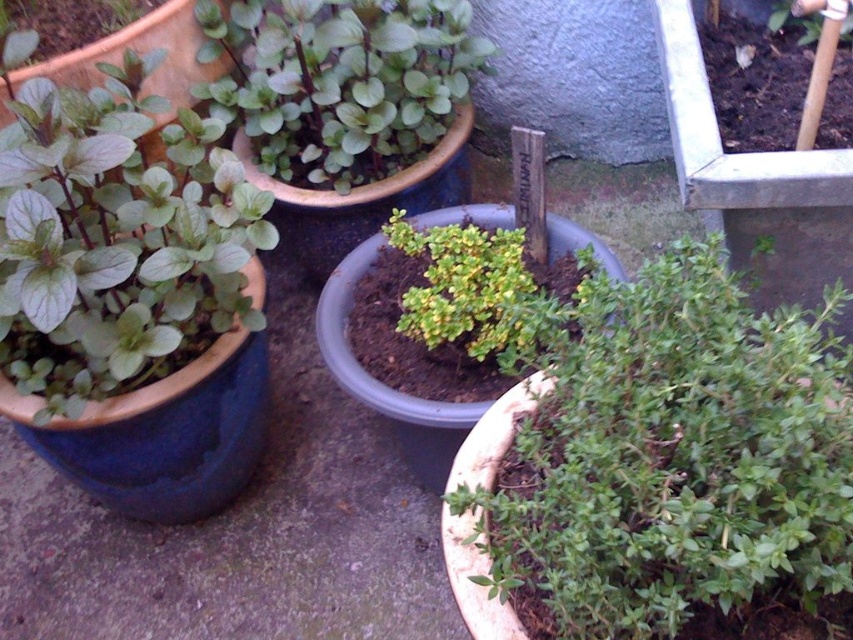
Can you confirm if green matte plant at center is bigger than green matte pot at upper left?

Yes, green matte plant at center is bigger than green matte pot at upper left.

This screenshot has height=640, width=853. What do you see at coordinates (662, 468) in the screenshot?
I see `green matte plant at center` at bounding box center [662, 468].

Find the location of `green matte plant at center`. green matte plant at center is located at coordinates (662, 468).

Is green matte plant at center smaller than green matte leaves at left?

Incorrect, green matte plant at center is not smaller in size than green matte leaves at left.

Is point (466, 531) in front of point (131, 284)?

Yes, it is in front of point (131, 284).

Measure the distance between green matte plant at center and camera.

25.47 inches

At what (x,y) coordinates should I click in order to perform the action: click on green matte plant at center. Please return your answer as a coordinate pair (x, y). Looking at the image, I should click on (662, 468).

How distant is green matte leaves at left from green matte pot at upper left?

The distance of green matte leaves at left from green matte pot at upper left is 40.14 centimeters.

Can you confirm if green matte leaves at left is taller than green matte pot at upper left?

Indeed, green matte leaves at left has a greater height compared to green matte pot at upper left.

Is point (28, 188) closer to camera compared to point (384, 115)?

Yes, point (28, 188) is closer to viewer.

Image resolution: width=853 pixels, height=640 pixels. I want to click on green matte leaves at left, so (112, 244).